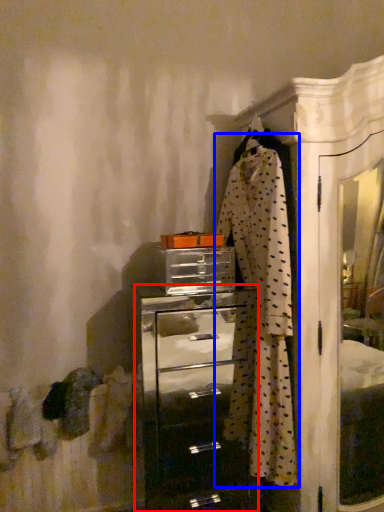
Question: Which of the following is the farthest to the observer, chest of drawers (highlighted by a red box) or clothing (highlighted by a blue box)?

Choices:
 (A) chest of drawers
 (B) clothing

Answer: (A)